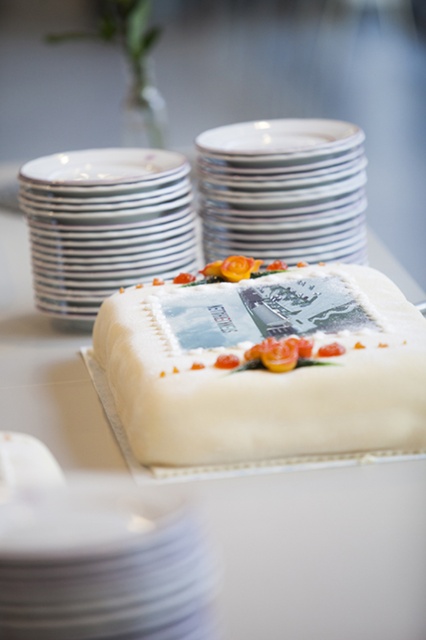
You are a guest at a formal dinner and see the white smooth cake at center and the white ceramic plates at upper left. Which object is closer to you?

The white smooth cake at center is closer to you because it is in front of the white ceramic plates at upper left.

You are a guest at a formal dinner and you see the white ceramic plates at upper left and the white glossy stack at upper center on the table. Which stack is closer to you?

The white ceramic plates at upper left are closer to you because they are in front of the white glossy stack at upper center.

You are a guest at a formal dinner and see the white ceramic platter at center and the white glossy stack at upper center on the table. Which object is positioned to the left of the other?

The white ceramic platter at center is to the left of the white glossy stack at upper center.